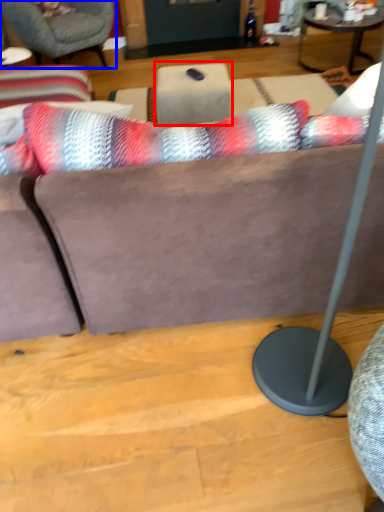
Question: Which point is closer to the camera, table (highlighted by a red box) or chair (highlighted by a blue box)?

Choices:
 (A) table
 (B) chair

Answer: (A)